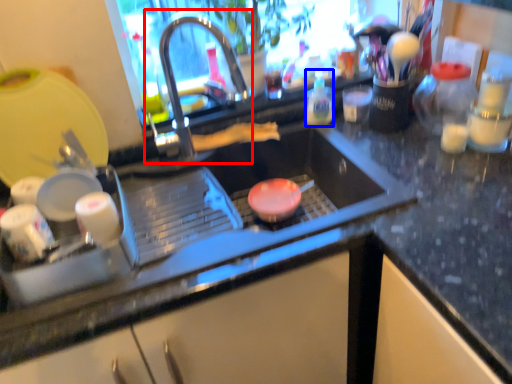
Question: Which point is closer to the camera, tap (highlighted by a red box) or bottle (highlighted by a blue box)?

Choices:
 (A) tap
 (B) bottle

Answer: (A)